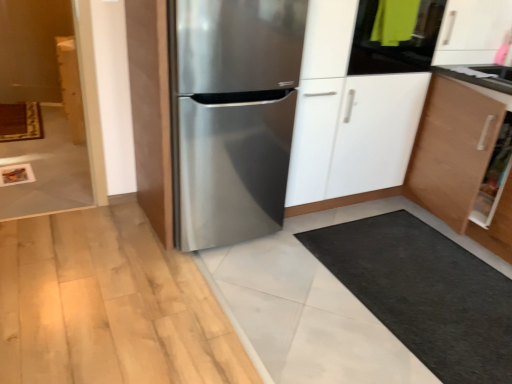
Where is `wooden cabinet at left`? The width and height of the screenshot is (512, 384). wooden cabinet at left is located at coordinates (71, 87).

You are a GUI agent. You are given a task and a screenshot of the screen. Output one action in this format:
    pyautogui.click(x=<x>, y=<y>)
    Task: Click on the white glossy countertop at upper right
    
    Given the screenshot: What is the action you would take?
    pyautogui.click(x=483, y=79)

The width and height of the screenshot is (512, 384). Identify the location of stainless steel refrigerator at center. (232, 116).

This screenshot has width=512, height=384. What do you see at coordinates (232, 116) in the screenshot?
I see `stainless steel refrigerator at center` at bounding box center [232, 116].

Identify the location of wooden cabinet at left. Image resolution: width=512 pixels, height=384 pixels. (71, 87).

Looking at the image, does wooden cabinet at left seem bigger or smaller compared to white glossy countertop at upper right?

wooden cabinet at left is bigger than white glossy countertop at upper right.

Is wooden cabinet at left facing away from white glossy countertop at upper right?

wooden cabinet at left does not have its back to white glossy countertop at upper right.

From the image's perspective, is wooden cabinet at left beneath white glossy countertop at upper right?

Incorrect, from the image's perspective, wooden cabinet at left is higher than white glossy countertop at upper right.

Considering the sizes of wooden cabinet at left and white glossy countertop at upper right in the image, is wooden cabinet at left wider or thinner than white glossy countertop at upper right?

Considering their sizes, wooden cabinet at left looks slimmer than white glossy countertop at upper right.

Which object is wider, stainless steel refrigerator at center or white glossy countertop at upper right?

stainless steel refrigerator at center.

From a real-world perspective, relative to white glossy countertop at upper right, is stainless steel refrigerator at center vertically above or below?

In terms of real-world spatial position, stainless steel refrigerator at center is below white glossy countertop at upper right.

In the image, is stainless steel refrigerator at center on the left side or the right side of white glossy countertop at upper right?

In the image, stainless steel refrigerator at center appears on the left side of white glossy countertop at upper right.

Looking at this image, is stainless steel refrigerator at center aimed at white glossy countertop at upper right?

Yes, stainless steel refrigerator at center faces towards white glossy countertop at upper right.

Is stainless steel refrigerator at center turned away from wooden cabinet at left?

Yes, stainless steel refrigerator at center is facing away from wooden cabinet at left.

Does point (205, 175) come farther from viewer compared to point (73, 87)?

That is False.

From a real-world perspective, is stainless steel refrigerator at center over wooden cabinet at left?

Correct, in the physical world, stainless steel refrigerator at center is higher than wooden cabinet at left.

In the image, is stainless steel refrigerator at center positioned in front of or behind wooden cabinet at left?

Visually, stainless steel refrigerator at center is located in front of wooden cabinet at left.

From the image's perspective, between wooden cabinet at left and stainless steel refrigerator at center, who is located below?

stainless steel refrigerator at center appears lower in the image.

Looking at this image, considering the sizes of objects wooden cabinet at left and stainless steel refrigerator at center in the image provided, who is taller, wooden cabinet at left or stainless steel refrigerator at center?

With more height is stainless steel refrigerator at center.

In the scene shown: Is wooden cabinet at left positioned far away from stainless steel refrigerator at center?

wooden cabinet at left is positioned a significant distance from stainless steel refrigerator at center.

Is wooden cabinet at left oriented towards stainless steel refrigerator at center?

No, wooden cabinet at left is not facing towards stainless steel refrigerator at center.

Is stainless steel refrigerator at center wider than stainless steel refrigerator at center?

In fact, stainless steel refrigerator at center might be narrower than stainless steel refrigerator at center.

In terms of size, does stainless steel refrigerator at center appear bigger or smaller than stainless steel refrigerator at center?

Considering their sizes, stainless steel refrigerator at center takes up less space than stainless steel refrigerator at center.

Can you tell me how much stainless steel refrigerator at center and stainless steel refrigerator at center differ in facing direction?

0.000276 degrees separate the facing orientations of stainless steel refrigerator at center and stainless steel refrigerator at center.

Do you think stainless steel refrigerator at center is within stainless steel refrigerator at center, or outside of it?

stainless steel refrigerator at center is spatially positioned inside stainless steel refrigerator at center.

At what (x,y) coordinates should I click in order to perform the action: click on dresser on the right of wooden cabinet at left. Please return your answer as a coordinate pair (x, y). Image resolution: width=512 pixels, height=384 pixels. Looking at the image, I should click on (387, 132).

Considering the relative sizes of stainless steel refrigerator at center and wooden cabinet at left in the image provided, is stainless steel refrigerator at center taller than wooden cabinet at left?

Correct, stainless steel refrigerator at center is much taller as wooden cabinet at left.

Is stainless steel refrigerator at center far away from wooden cabinet at left?

That's right, there is a large distance between stainless steel refrigerator at center and wooden cabinet at left.

From the image's perspective, which one is positioned lower, stainless steel refrigerator at center or wooden cabinet at left?

stainless steel refrigerator at center appears lower in the image.

From a real-world perspective, relative to stainless steel refrigerator at center, is white glossy countertop at upper right vertically above or below?

white glossy countertop at upper right is situated higher than stainless steel refrigerator at center in the real world.

Considering the sizes of objects white glossy countertop at upper right and stainless steel refrigerator at center in the image provided, who is thinner, white glossy countertop at upper right or stainless steel refrigerator at center?

Thinner between the two is white glossy countertop at upper right.

In the image, is white glossy countertop at upper right on the left side or the right side of stainless steel refrigerator at center?

white glossy countertop at upper right is to the right of stainless steel refrigerator at center.

Where is `counter top in front of the wooden cabinet at left`? The image size is (512, 384). counter top in front of the wooden cabinet at left is located at coordinates (483, 79).

This screenshot has height=384, width=512. In the image, there is a white glossy countertop at upper right. Identify the location of dresser below it (from the image's perspective). (387, 132).

When comparing their distances from stainless steel refrigerator at center, does wooden cabinet at left or stainless steel refrigerator at center seem closer?

stainless steel refrigerator at center is positioned closer to the anchor stainless steel refrigerator at center.

When comparing their distances from white glossy countertop at upper right, does wooden cabinet at left or stainless steel refrigerator at center seem further?

Based on the image, wooden cabinet at left appears to be further to white glossy countertop at upper right.

When comparing their distances from wooden cabinet at left, does white glossy countertop at upper right or stainless steel refrigerator at center seem further?

white glossy countertop at upper right is positioned further to the anchor wooden cabinet at left.

Based on their spatial positions, is white glossy countertop at upper right or stainless steel refrigerator at center further from wooden cabinet at left?

The object further to wooden cabinet at left is white glossy countertop at upper right.

Considering their positions, is wooden cabinet at left positioned further to white glossy countertop at upper right than stainless steel refrigerator at center?

Based on the image, wooden cabinet at left appears to be further to white glossy countertop at upper right.

Which object lies nearer to the anchor point stainless steel refrigerator at center, wooden cabinet at left or white glossy countertop at upper right?

Based on the image, white glossy countertop at upper right appears to be nearer to stainless steel refrigerator at center.

Which object lies further to the anchor point stainless steel refrigerator at center, stainless steel refrigerator at center or white glossy countertop at upper right?

stainless steel refrigerator at center lies further to stainless steel refrigerator at center than the other object.

When comparing their distances from stainless steel refrigerator at center, does white glossy countertop at upper right or stainless steel refrigerator at center seem closer?

white glossy countertop at upper right is positioned closer to the anchor stainless steel refrigerator at center.

Locate an element on the screen. refrigerator between wooden cabinet at left and stainless steel refrigerator at center from left to right is located at coordinates (232, 116).

This screenshot has height=384, width=512. I want to click on dresser between wooden cabinet at left and white glossy countertop at upper right, so click(387, 132).

The height and width of the screenshot is (384, 512). In order to click on refrigerator located between wooden cabinet at left and white glossy countertop at upper right in the left-right direction in this screenshot , I will do `click(232, 116)`.

This screenshot has height=384, width=512. In order to click on dresser located between stainless steel refrigerator at center and white glossy countertop at upper right in the left-right direction in this screenshot , I will do `click(387, 132)`.